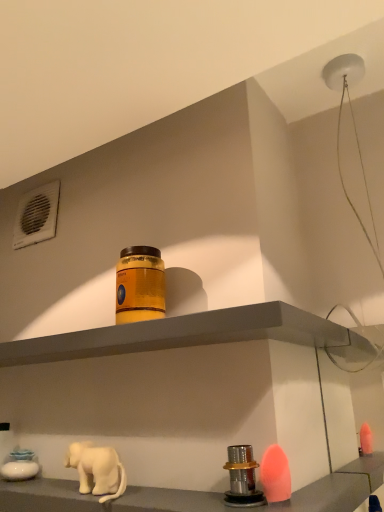
Find the location of a particular element. free location to the left of white matte elephant at lower left is located at coordinates (37, 493).